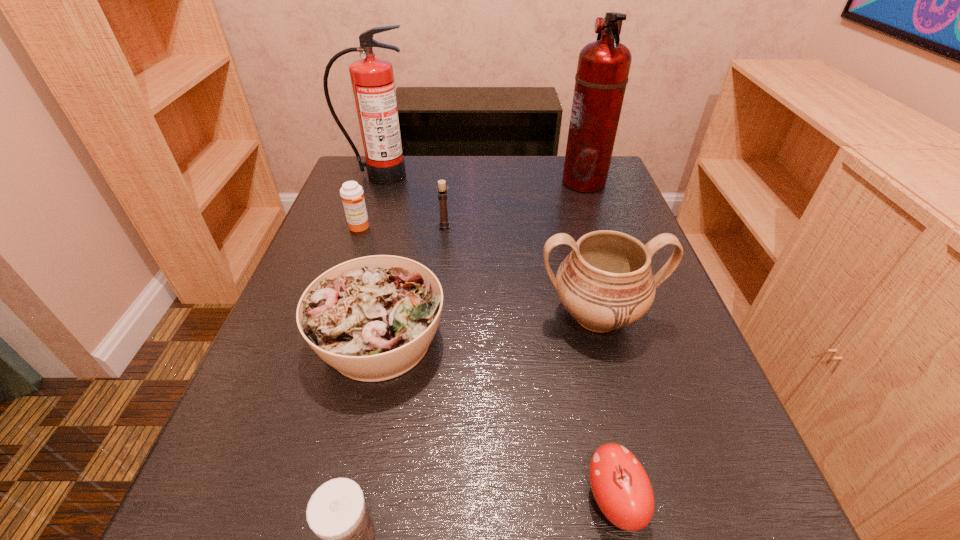
Identify the location of the right fire extinguisher. The height and width of the screenshot is (540, 960). (603, 67).

At what (x,y) coordinates should I click in order to perform the action: click on the left fire extinguisher. Please return your answer as a coordinate pair (x, y). Looking at the image, I should click on (372, 79).

Locate an element on the screen. The image size is (960, 540). urn is located at coordinates (606, 282).

You are a GUI agent. You are given a task and a screenshot of the screen. Output one action in this format:
    pyautogui.click(x=<x>, y=<y>)
    Task: Click on the candle holder
    This screenshot has height=540, width=960.
    Given the screenshot: What is the action you would take?
    pyautogui.click(x=444, y=222)

Find the location of a particular element. This screenshot has width=960, height=540. salad is located at coordinates (372, 318).

In order to click on the left medicine in this screenshot , I will do `click(351, 193)`.

You are a GUI agent. You are given a task and a screenshot of the screen. Output one action in this format:
    pyautogui.click(x=<x>, y=<y>)
    Task: Click on the blank area located 0.400m on the nozzle side of the right fire extinguisher
    This screenshot has width=960, height=540.
    Given the screenshot: What is the action you would take?
    pyautogui.click(x=409, y=181)

Identify the location of blank space located on the nozzle side of the right fire extinguisher. The height and width of the screenshot is (540, 960). (504, 181).

Image resolution: width=960 pixels, height=540 pixels. What are the coordinates of `vacant area situated 0.260m on the nozzle side of the right fire extinguisher` in the screenshot? It's located at (463, 181).

Identify the location of vacant space situated 0.090m on the front-facing side of the left fire extinguisher. (370, 204).